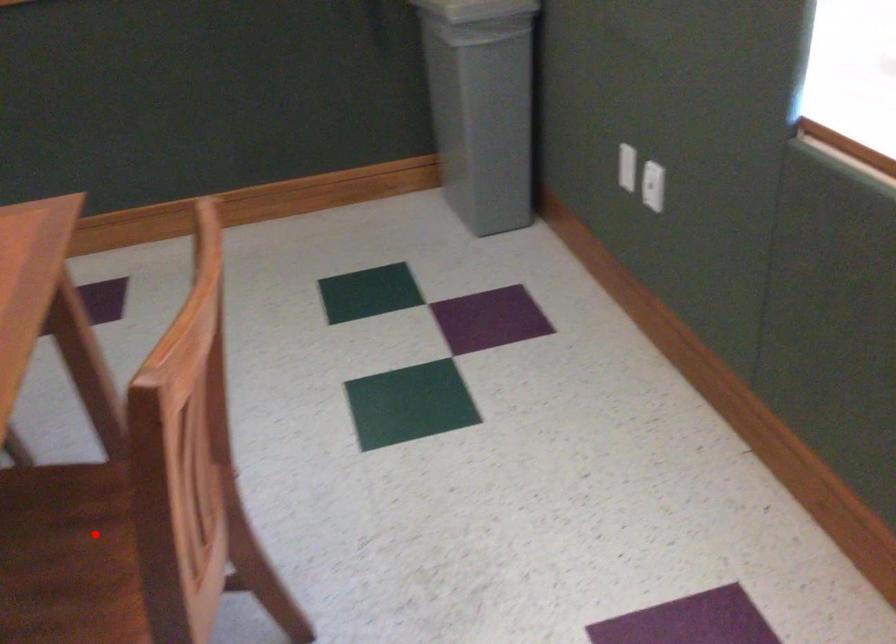
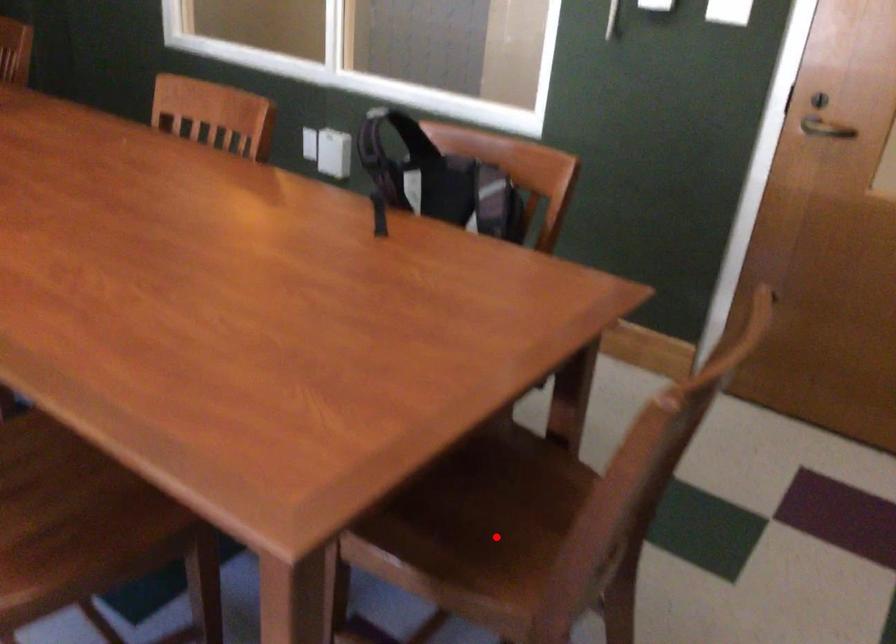
I am providing you with two images of the same scene from different viewpoints. A red point is marked on the first image and another point is marked on the second image. Is the marked point in image1 the same physical position as the marked point in image2?

No